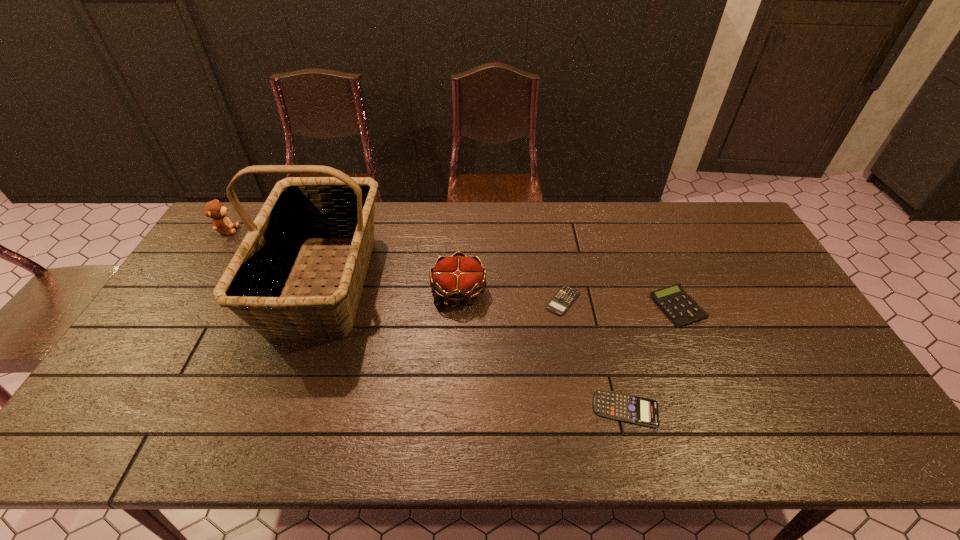
Where is `vacant area that satisfies the following two spatial constraints: 1. on the back side of the nearest object; 2. on the face of the teddy bear`? vacant area that satisfies the following two spatial constraints: 1. on the back side of the nearest object; 2. on the face of the teddy bear is located at coordinates pos(581,230).

Find the location of a particular element. blank area in the image that satisfies the following two spatial constraints: 1. by the handle of the rightmost object; 2. on the left side of the basket is located at coordinates (317, 307).

At what (x,y) coordinates should I click in order to perform the action: click on free space that satisfies the following two spatial constraints: 1. by the handle of the fifth object from right to left; 2. on the left side of the rightmost calculator. Please return your answer as a coordinate pair (x, y). The image size is (960, 540). Looking at the image, I should click on (317, 307).

Locate an element on the screen. free space in the image that satisfies the following two spatial constraints: 1. on the front side of the nearest object; 2. on the left side of the shortest calculator is located at coordinates (582, 409).

Locate an element on the screen. The image size is (960, 540). free spot that satisfies the following two spatial constraints: 1. by the handle of the rightmost calculator; 2. on the right side of the second object from left to right is located at coordinates point(317,307).